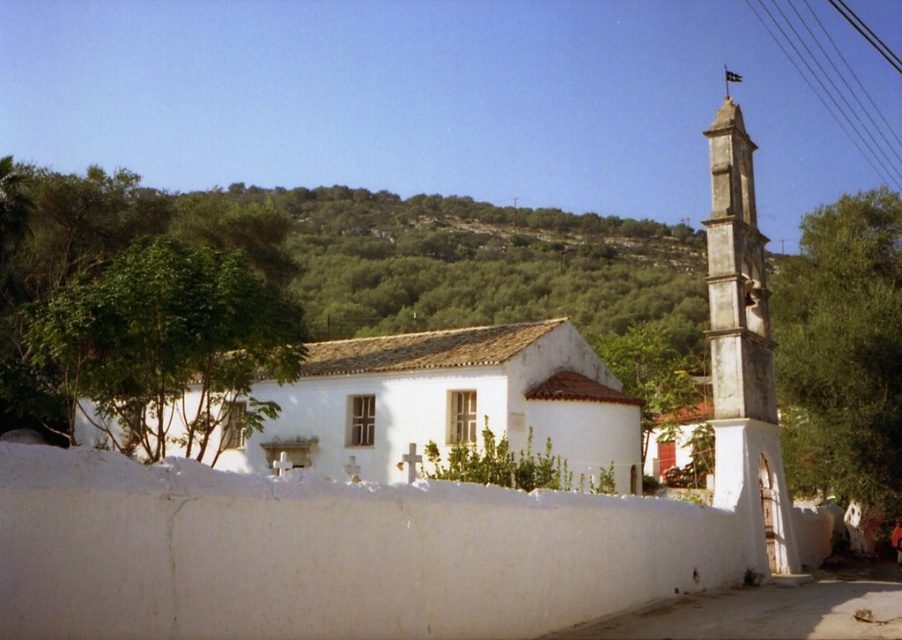
You are a visitor standing in front of the white matte church at center and the green leafy tree at left. Which object appears larger in the scene?

The green leafy tree at left appears larger than the white matte church at center.

You are a bird flying over the rural area and want to land on the tallest structure. Which one should you choose between the white matte church at center and the white stone tower at right?

The white stone tower at right is taller than the white matte church at center, so you should land on the white stone tower at right.